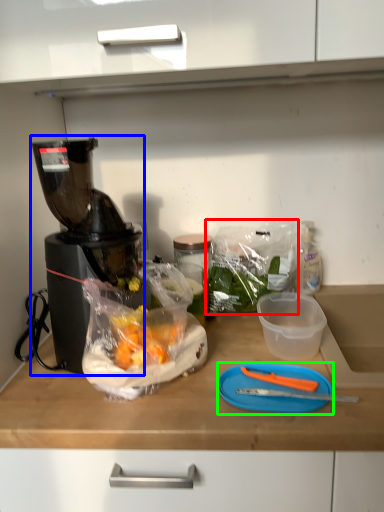
Question: Which object is positioned farthest from plastic bag (highlighted by a red box)? Select from blender (highlighted by a blue box) and cutting board (highlighted by a green box).

Choices:
 (A) blender
 (B) cutting board

Answer: (A)